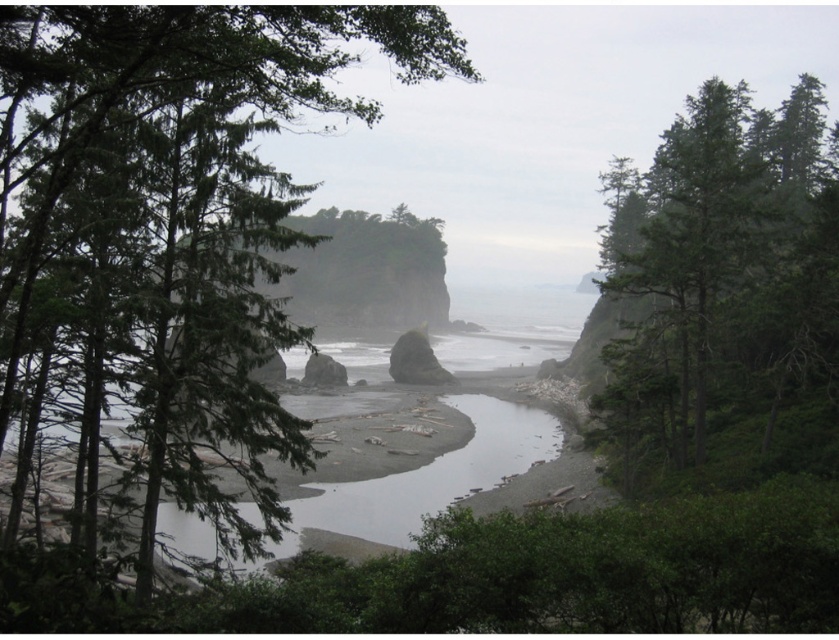
Consider the image. You are standing at the center of the image and want to find the green leafy tree at center. In which direction should you look to locate it?

The green leafy tree at center is located at point coordinates, so you should look towards the center of the image to find it.

You are a hiker who wants to take a photo of both the green leafy tree at center and the green textured tree at upper right in the scene. If your camera can focus on objects up to 25 meters away, will you be able to capture both trees in one shot without moving the camera?

The green leafy tree at center is 24.87 meters away from the green textured tree at upper right. Since the distance between them is within the camera maximum focus range of 25 meters, you can capture both trees in one shot without moving the camera.

You are standing in the coastal landscape and want to take a photo of both the green leafy tree at center and the green textured tree at upper right. Which tree should you focus on first to ensure both are in clear view?

You should focus on the green leafy tree at center first because it is closer to you than the green textured tree at upper right, allowing both to be in focus when using a camera with a proper depth of field setting.